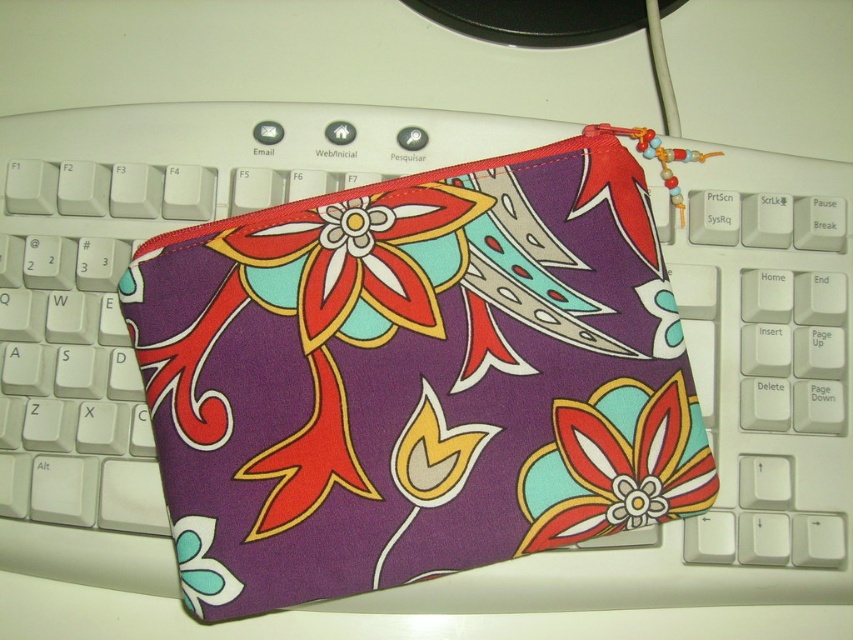
Question: Is purple fabric pouch at center positioned at the back of floral fabric flower at center?

Choices:
 (A) yes
 (B) no

Answer: (B)

Question: Which of the following is the farthest from the observer?

Choices:
 (A) floral fabric flower at center
 (B) purple fabric pouch at center
 (C) matte fabric flower at center

Answer: (A)

Question: Is purple fabric pouch at center wider than matte fabric flower at center?

Choices:
 (A) no
 (B) yes

Answer: (B)

Question: Does purple fabric pouch at center have a greater width compared to floral fabric flower at center?

Choices:
 (A) no
 (B) yes

Answer: (B)

Question: Which of the following is the closest to the observer?

Choices:
 (A) (587, 208)
 (B) (409, 314)
 (C) (590, 403)

Answer: (C)

Question: Considering the real-world distances, which object is farthest from the purple fabric pouch at center?

Choices:
 (A) floral fabric flower at center
 (B) matte fabric flower at center

Answer: (B)